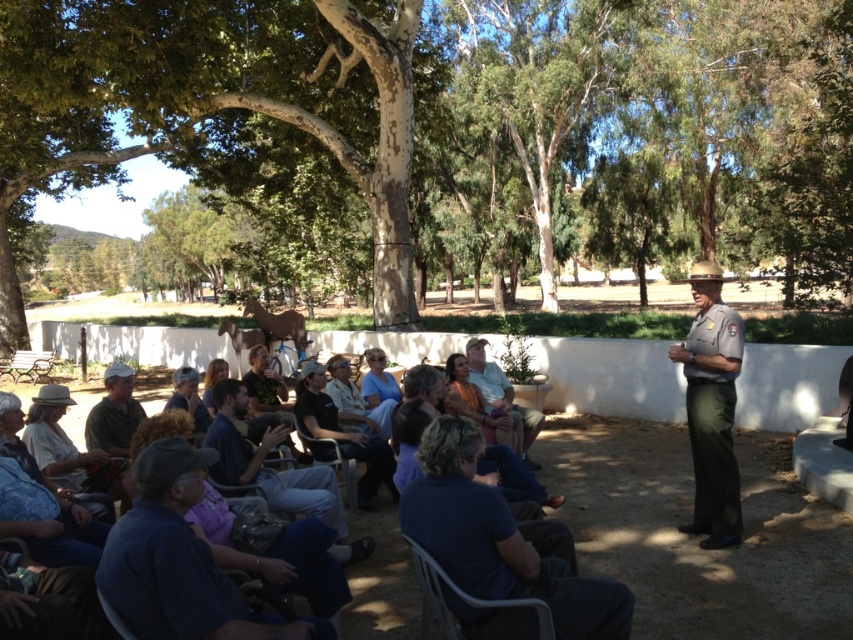
You are organizing a small event and need to place a 1.2 meter wide table between the blue fabric shirt at center and the wooden bench at lower left. Can the space accommodate the table?

The blue fabric shirt at center has a lesser width compared to wooden bench at lower left. However, the exact distance between them isn not specified in the provided description. Without knowing the actual spacing, it is impossible to determine if the 1.2 meter wide table will fit.

You are a photographer at the event and want to capture a photo of both the gray uniform at right and the dark blue shirt at center. Which clothing item will appear taller in the photo?

The dark blue shirt at center will appear taller in the photo because it is taller than the gray uniform at right.